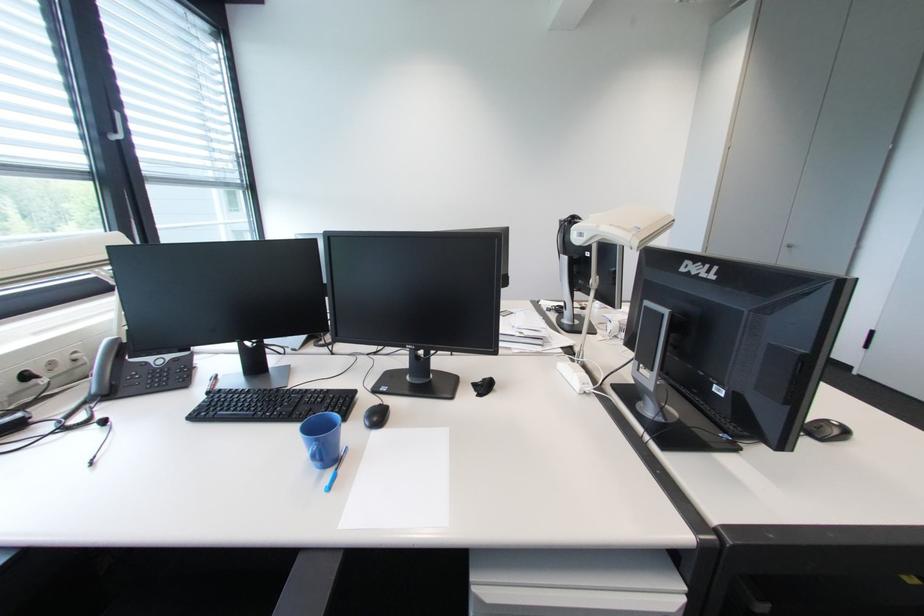
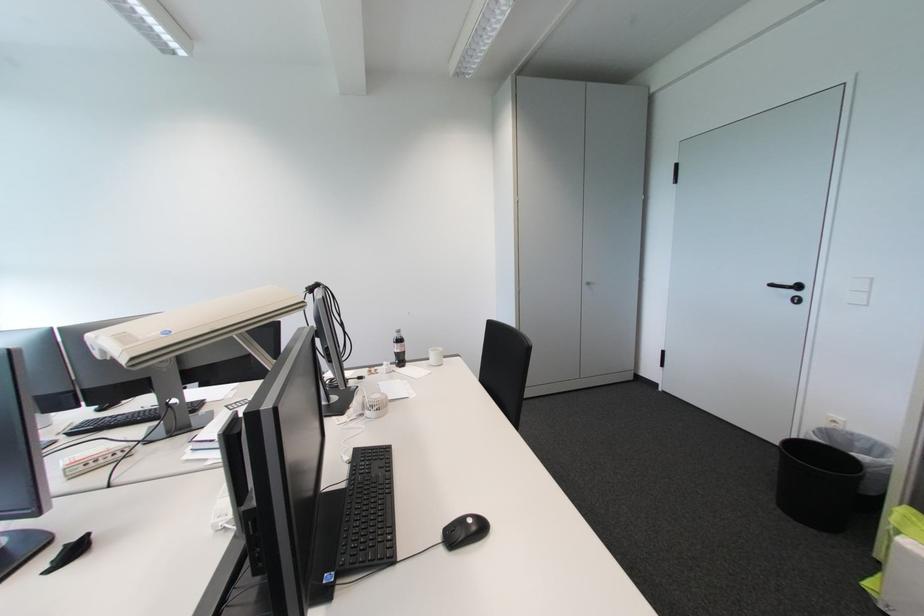
Question: What movement of the cameraman would produce the second image?

Choices:
 (A) Left
 (B) Right
 (C) Forward
 (D) Backward

Answer: (B)